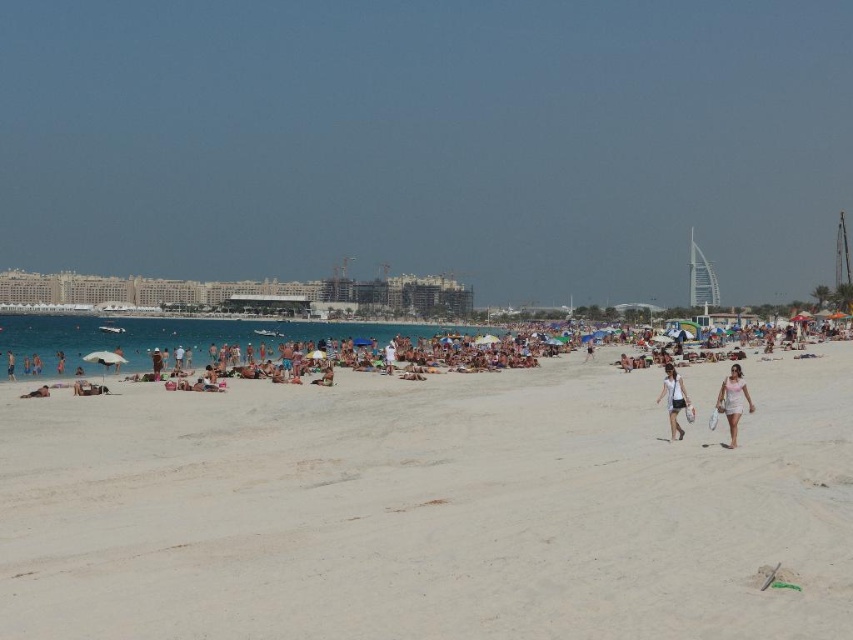
Is pink fabric shorts at lower right to the right of white fabric shorts at center from the viewer's perspective?

Indeed, pink fabric shorts at lower right is positioned on the right side of white fabric shorts at center.

Who is taller, pink fabric shorts at lower right or white fabric shorts at center?

pink fabric shorts at lower right is taller.

Looking at this image, who is more forward, (751, 412) or (668, 364)?

Positioned in front is point (751, 412).

This screenshot has width=853, height=640. What are the coordinates of `pink fabric shorts at lower right` in the screenshot? It's located at (733, 401).

Which is more to the left, pink fabric shorts at lower right or tan skin person at lower left?

tan skin person at lower left is more to the left.

Can you confirm if pink fabric shorts at lower right is shorter than tan skin person at lower left?

No.

Does point (728, 406) lie in front of point (13, 362)?

That is True.

You are a GUI agent. You are given a task and a screenshot of the screen. Output one action in this format:
    pyautogui.click(x=<x>, y=<y>)
    Task: Click on the pink fabric shorts at lower right
    The height and width of the screenshot is (640, 853).
    Given the screenshot: What is the action you would take?
    pyautogui.click(x=733, y=401)

Does white sandy beach at center appear on the right side of tan skin person at lower left?

Correct, you'll find white sandy beach at center to the right of tan skin person at lower left.

What do you see at coordinates (431, 508) in the screenshot? I see `white sandy beach at center` at bounding box center [431, 508].

The image size is (853, 640). I want to click on white sandy beach at center, so click(x=431, y=508).